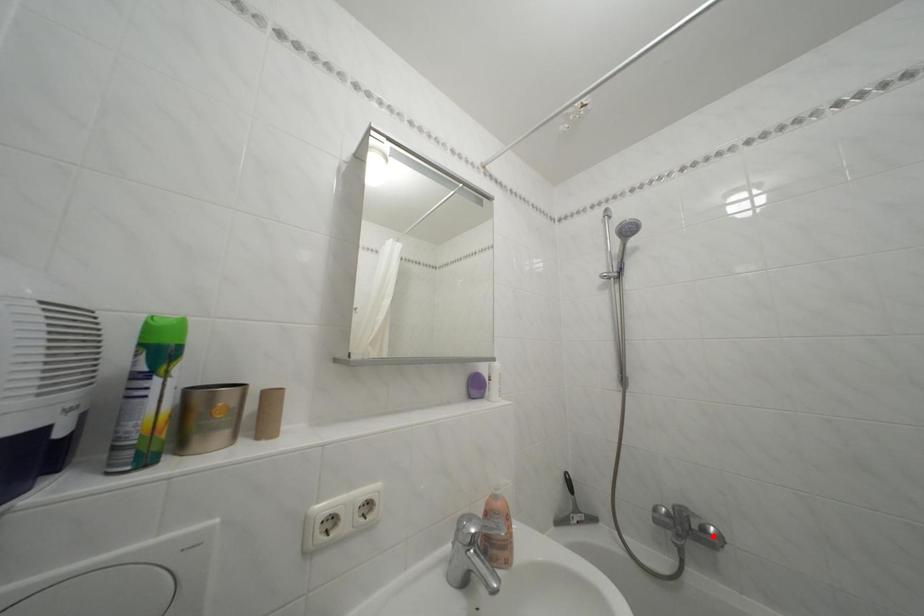
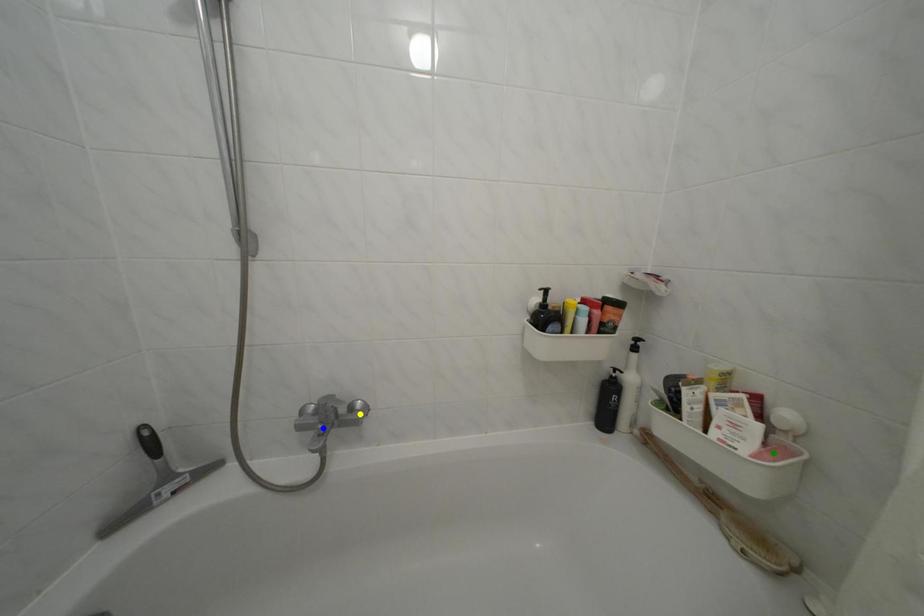
Question: I am providing you with two images of the same scene from different viewpoints. A red point is marked on the first image. You are given multiple points on the second image. Which point in image 2 is actually the same real-world point as the red point in image 1?

Choices:
 (A) blue point
 (B) yellow point
 (C) green point

Answer: (B)